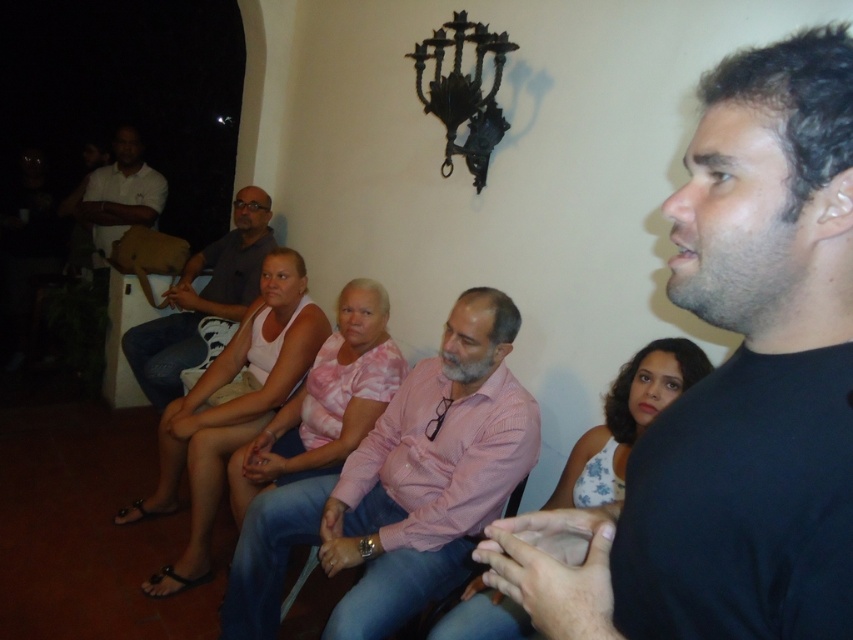
Question: Considering the relative positions of pink striped shirt at center and matte gray shirt at center in the image provided, where is pink striped shirt at center located with respect to matte gray shirt at center?

Choices:
 (A) right
 (B) left

Answer: (A)

Question: Which is nearer to the white matte shirt at upper left?

Choices:
 (A) pink striped shirt at center
 (B) black matte shirt at center
 (C) matte gray shirt at center

Answer: (C)

Question: Is the position of black matte shirt at center more distant than that of pink striped shirt at center?

Choices:
 (A) yes
 (B) no

Answer: (B)

Question: Is pink striped shirt at center to the left of white matte shirt at upper left from the viewer's perspective?

Choices:
 (A) no
 (B) yes

Answer: (A)

Question: Which point is farther from the camera taking this photo?

Choices:
 (A) (99, 262)
 (B) (250, 269)
 (C) (614, 593)
 (D) (479, 464)

Answer: (A)

Question: Which point is closer to the camera?

Choices:
 (A) pink striped shirt at center
 (B) black matte shirt at center
 (C) matte gray shirt at center

Answer: (B)